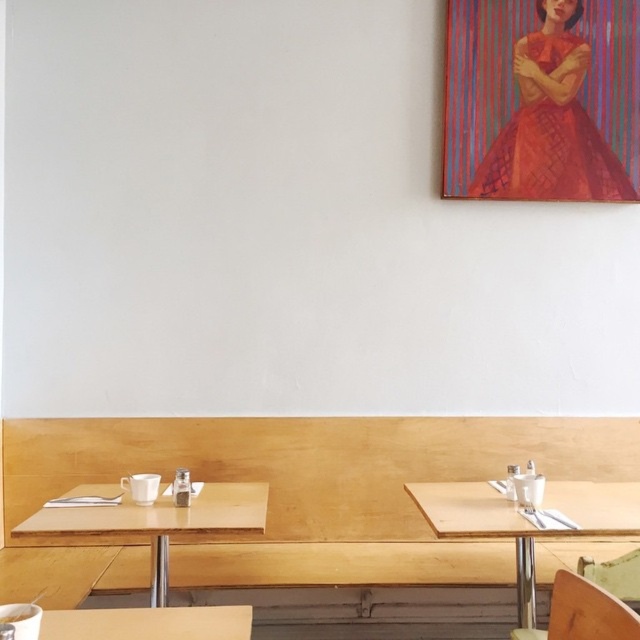
Can you confirm if light wood table at lower left is positioned to the left of wooden table at right?

Correct, you'll find light wood table at lower left to the left of wooden table at right.

Is point (150, 595) closer to viewer compared to point (611, 525)?

That is False.

Is point (224, 518) more distant than point (467, 531)?

Yes.

Locate an element on the screen. light wood table at lower left is located at coordinates (152, 518).

Who is higher up, red woven fabric dress at upper right or wooden table at right?

red woven fabric dress at upper right is above.

Between point (611, 164) and point (529, 564), which one is positioned in front?

Point (529, 564) is more forward.

This screenshot has height=640, width=640. What are the coordinates of `red woven fabric dress at upper right` in the screenshot? It's located at (550, 131).

Where is `red woven fabric dress at upper right`? The width and height of the screenshot is (640, 640). red woven fabric dress at upper right is located at coordinates (550, 131).

Which of these two, red woven fabric dress at upper right or wooden chair at lower right, stands shorter?

With less height is wooden chair at lower right.

Between point (560, 166) and point (572, 609), which one is positioned behind?

Point (560, 166)

At what (x,y) coordinates should I click in order to perform the action: click on red woven fabric dress at upper right. Please return your answer as a coordinate pair (x, y). Looking at the image, I should click on (550, 131).